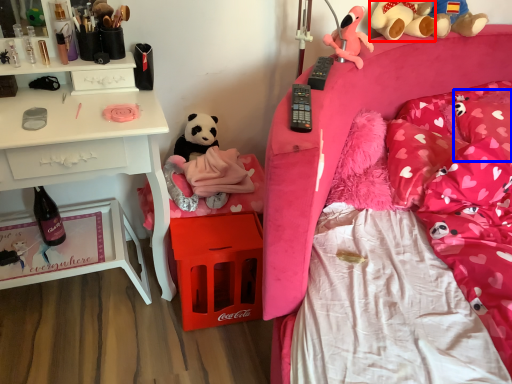
Question: Which object is further to the camera taking this photo, teddy bear (highlighted by a red box) or pillow (highlighted by a blue box)?

Choices:
 (A) teddy bear
 (B) pillow

Answer: (A)